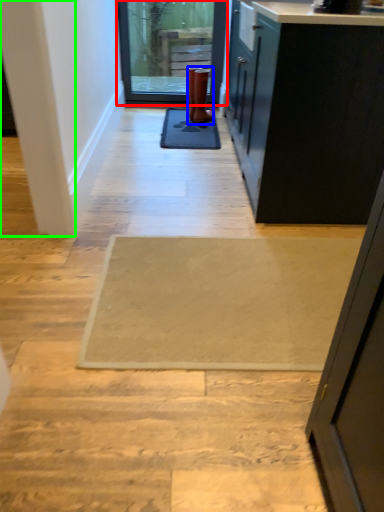
Question: Which is nearer to the door (highlighted by a red box)? boot (highlighted by a blue box) or pillar (highlighted by a green box).

Choices:
 (A) boot
 (B) pillar

Answer: (A)